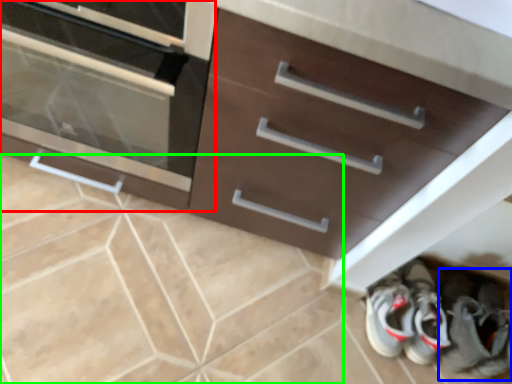
Question: Which is farther away from chest of drawers (highlighted by a red box)? footwear (highlighted by a blue box) or ceramic tile (highlighted by a green box)?

Choices:
 (A) footwear
 (B) ceramic tile

Answer: (A)